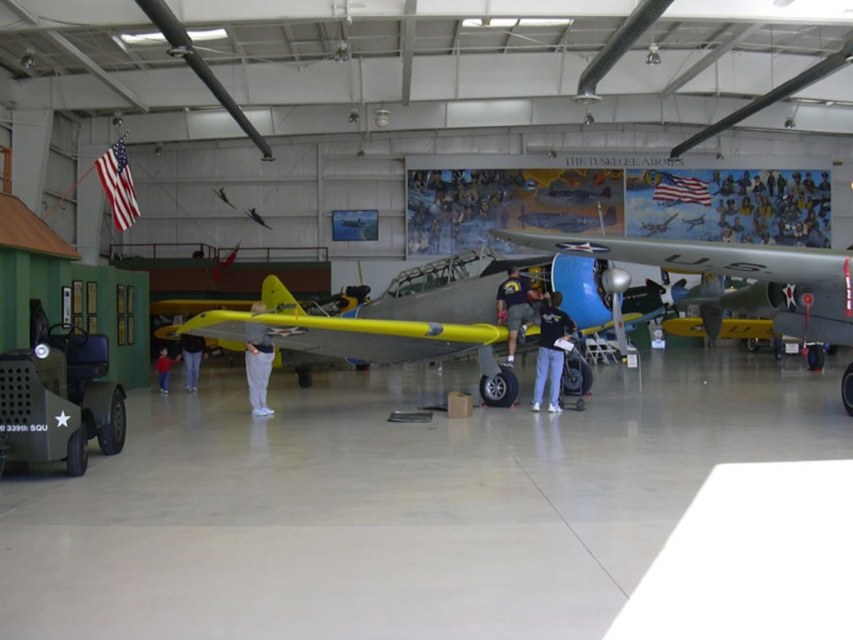
You are an event planner setting up a photo shoot in the hangar. You need to place a 3m wide banner between the matte silver airplane at center and the dark blue jeans at center. Will the banner fit without overlapping either object?

The matte silver airplane at center has a lesser width compared to dark blue jeans at center. The banner is 3 meters wide. To determine if it fits, we need to know the distance between the two objects. However, the provided information only states the relative widths of the objects, not the space between them. Without knowing the actual distance between the matte silver airplane at center and the dark blue jeans at center, it is impossible to confirm if the banner will fit without overlapping.

You are a museum guide leading a group through the hangar. You need to move a 3.5 meter long ladder from the entrance to the storage room located behind the airplanes. Can you safely carry the ladder horizontally between the matte silver airplane at center and the matte yellow airplane at center without hitting either?

The distance between the matte silver airplane at center and the matte yellow airplane at center is 3.44 meters. Since the ladder is 3.5 meters long, it is slightly longer than the gap between the airplanes. Therefore, you cannot safely carry the ladder horizontally between them without risking a collision.